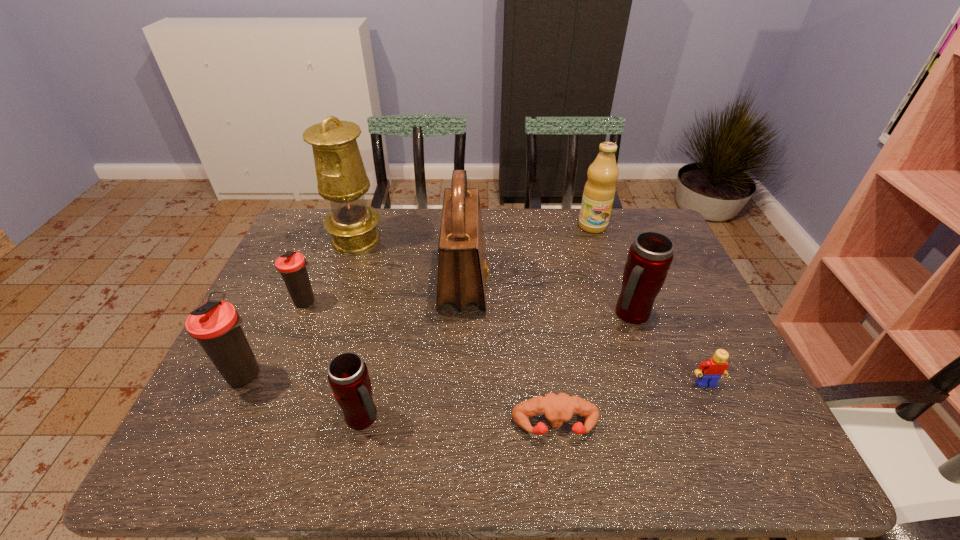
Image resolution: width=960 pixels, height=540 pixels. I want to click on vacant region located on the back of the farther brown thermos bottle, so click(320, 268).

Find the location of a particular element. This screenshot has height=540, width=960. vacant space located on the side with the handle of the left red thermos bottle is located at coordinates (443, 417).

Where is `vacant space located 0.140m on the face of the rightmost object`? Image resolution: width=960 pixels, height=540 pixels. vacant space located 0.140m on the face of the rightmost object is located at coordinates (733, 446).

Where is `oil lamp located at the far edge`? The width and height of the screenshot is (960, 540). oil lamp located at the far edge is located at coordinates (341, 176).

Identify the location of olive oil that is at the far edge. (599, 191).

The image size is (960, 540). In order to click on thermos bottle located at the near edge in this screenshot , I will do `click(348, 376)`.

Find the location of a particular element. puncher at the near edge is located at coordinates (557, 409).

At what (x,y) coordinates should I click in order to perform the action: click on oil lamp that is at the left edge. Please return your answer as a coordinate pair (x, y). The image size is (960, 540). Looking at the image, I should click on (341, 176).

Image resolution: width=960 pixels, height=540 pixels. I want to click on thermos bottle situated at the right edge, so click(650, 256).

Locate an element on the screen. Lego situated at the right edge is located at coordinates (710, 371).